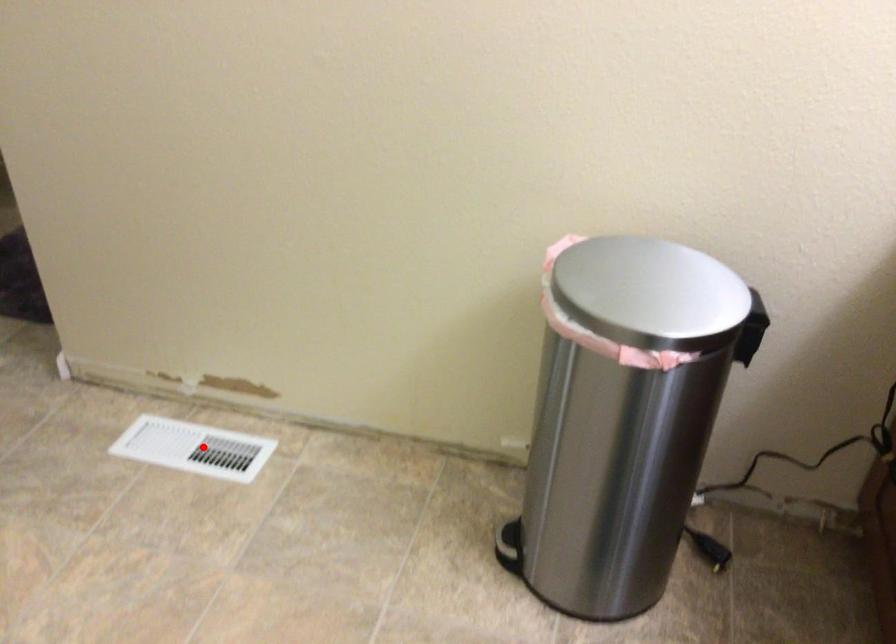
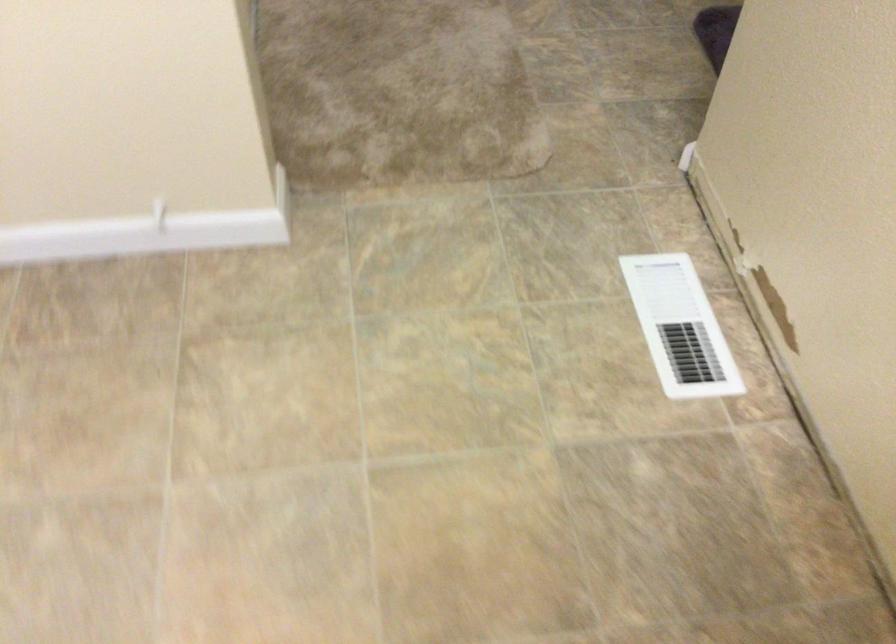
The point at the highlighted location is marked in the first image. Where is the corresponding point in the second image?

(679, 327)